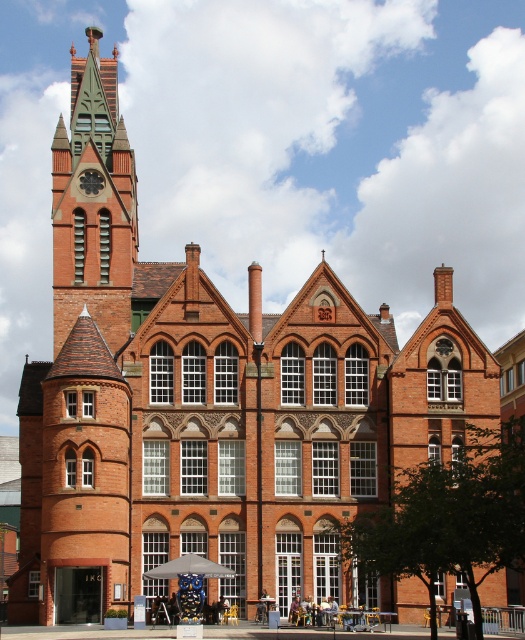
Question: Which point appears farthest from the camera in this image?

Choices:
 (A) (106, 330)
 (B) (172, 563)

Answer: (A)

Question: Which point is farther to the camera?

Choices:
 (A) gray fabric umbrella at center
 (B) green glass clock tower at upper left

Answer: (B)

Question: Can you confirm if green glass clock tower at upper left is positioned above gray fabric umbrella at center?

Choices:
 (A) yes
 (B) no

Answer: (A)

Question: From the image, what is the correct spatial relationship of green glass clock tower at upper left in relation to gray fabric umbrella at center?

Choices:
 (A) left
 (B) right

Answer: (A)

Question: Is green glass clock tower at upper left bigger than gray fabric umbrella at center?

Choices:
 (A) no
 (B) yes

Answer: (B)